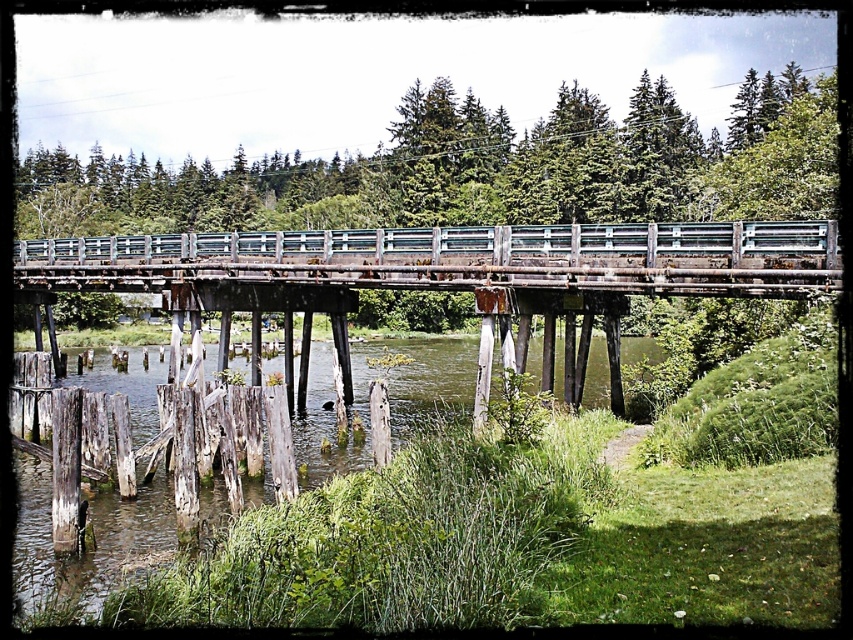
Question: Which point is farther from the camera taking this photo?

Choices:
 (A) (460, 266)
 (B) (329, 369)

Answer: (B)

Question: Can you confirm if rusty metal bridge at center is positioned to the left of wooden posts at lower left?

Choices:
 (A) no
 (B) yes

Answer: (A)

Question: Which object appears closest to the camera in this image?

Choices:
 (A) rusty metal bridge at center
 (B) wooden posts at lower left

Answer: (B)

Question: Is rusty metal bridge at center behind wooden posts at lower left?

Choices:
 (A) no
 (B) yes

Answer: (B)

Question: Which point is farther to the camera?

Choices:
 (A) rusty metal bridge at center
 (B) wooden posts at lower left

Answer: (A)

Question: Can you confirm if rusty metal bridge at center is thinner than wooden posts at lower left?

Choices:
 (A) yes
 (B) no

Answer: (A)